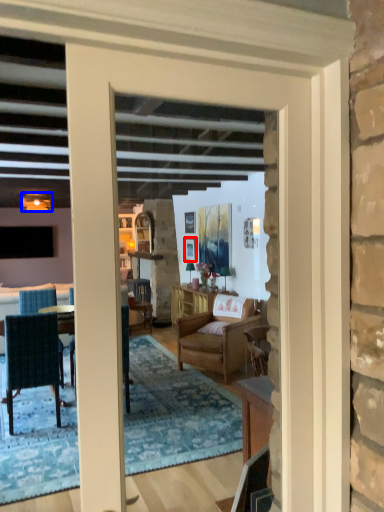
Question: Which object appears farthest to the camera in this image, picture frame (highlighted by a red box) or lamp (highlighted by a blue box)?

Choices:
 (A) picture frame
 (B) lamp

Answer: (A)